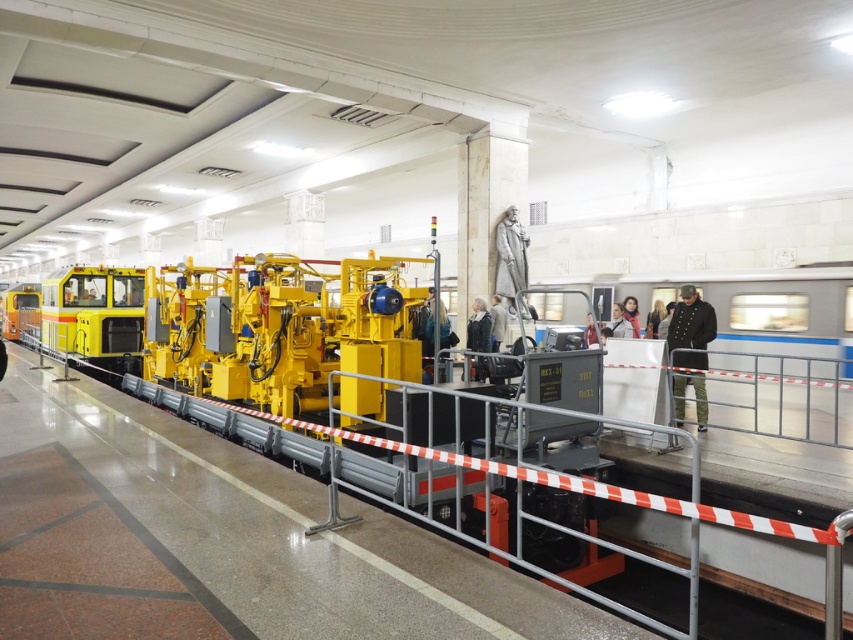
Who is lower down, dark blue uniform at center or matte black scarf at center?

dark blue uniform at center is lower down.

Find the location of a particular element. This screenshot has width=853, height=640. dark blue uniform at center is located at coordinates (654, 317).

Can you confirm if dark gray fabric coat at center is thinner than dark blue uniform at center?

Yes.

Is dark gray fabric coat at center smaller than dark blue uniform at center?

Yes, dark gray fabric coat at center is smaller than dark blue uniform at center.

Identify the location of dark gray fabric coat at center. (479, 326).

Is point (480, 317) in front of point (498, 330)?

That is True.

Is the position of dark gray fabric coat at center less distant than that of dark gray suit at center?

That is True.

The height and width of the screenshot is (640, 853). Identify the location of dark gray fabric coat at center. (479, 326).